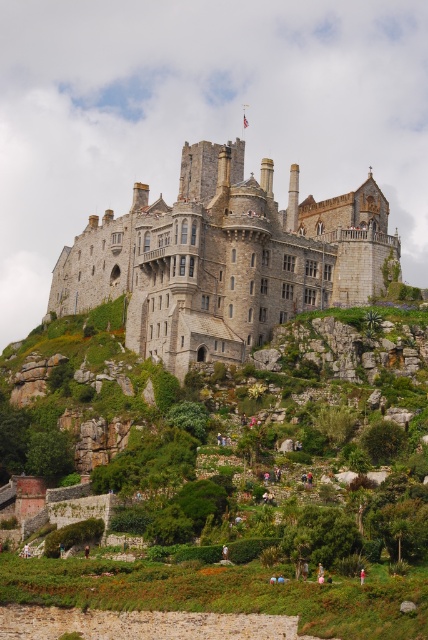
Is green fabric person at lower center to the right of brown leather jacket at lower center from the viewer's perspective?

No, green fabric person at lower center is not to the right of brown leather jacket at lower center.

Does point (64, 545) come in front of point (86, 554)?

That is False.

Identify the location of green fabric person at lower center. This screenshot has width=428, height=640. (62, 548).

Between stone castle at center and green fabric person at lower center, which one is positioned lower?

green fabric person at lower center is lower down.

Does stone castle at center appear over green fabric person at lower center?

Correct, stone castle at center is located above green fabric person at lower center.

Which is behind, point (350, 225) or point (59, 545)?

The point (350, 225) is more distant.

The width and height of the screenshot is (428, 640). Identify the location of stone castle at center. (225, 259).

Is point (309, 284) farther from viewer compared to point (89, 548)?

Yes, point (309, 284) is behind point (89, 548).

Is point (241, 260) closer to viewer compared to point (86, 554)?

No, (241, 260) is behind (86, 554).

At what (x,y) coordinates should I click in order to perform the action: click on stone castle at center. Please return your answer as a coordinate pair (x, y). Looking at the image, I should click on (225, 259).